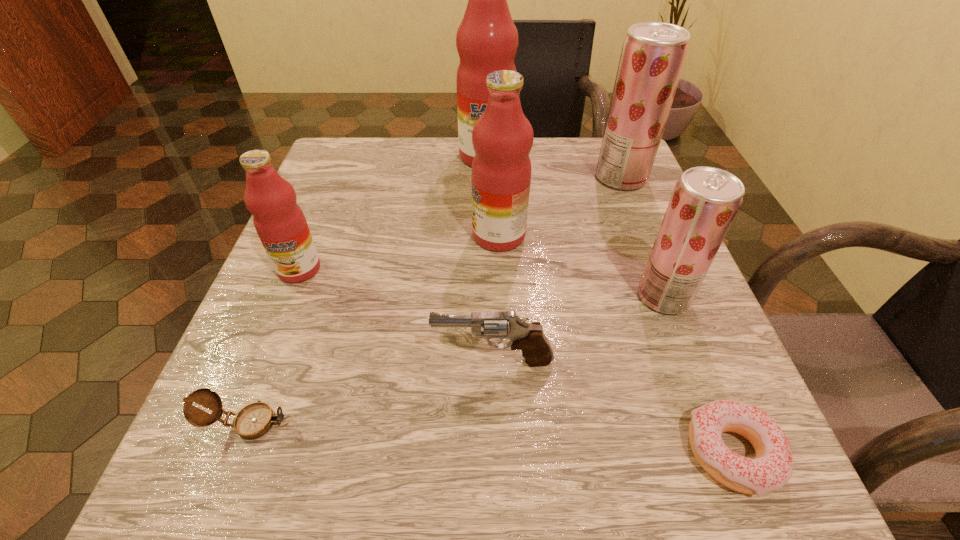
Where is `the tallest fruit juice`? The width and height of the screenshot is (960, 540). the tallest fruit juice is located at coordinates (487, 40).

The width and height of the screenshot is (960, 540). Identify the location of the farthest pink fruit juice. (487, 40).

Identify the location of the farther strawberry fruit juice. This screenshot has height=540, width=960. (653, 54).

Identify the location of the second biggest pink fruit juice. This screenshot has width=960, height=540. (502, 138).

The image size is (960, 540). I want to click on the second farthest pink fruit juice, so click(502, 138).

I want to click on the smaller strawberry fruit juice, so click(x=705, y=201).

This screenshot has height=540, width=960. I want to click on the nearest pink fruit juice, so click(280, 223).

This screenshot has height=540, width=960. I want to click on the leftmost fruit juice, so click(280, 223).

Locate an element on the screen. The width and height of the screenshot is (960, 540). the sixth tallest object is located at coordinates (536, 349).

The image size is (960, 540). Identify the location of gray pistol. (536, 349).